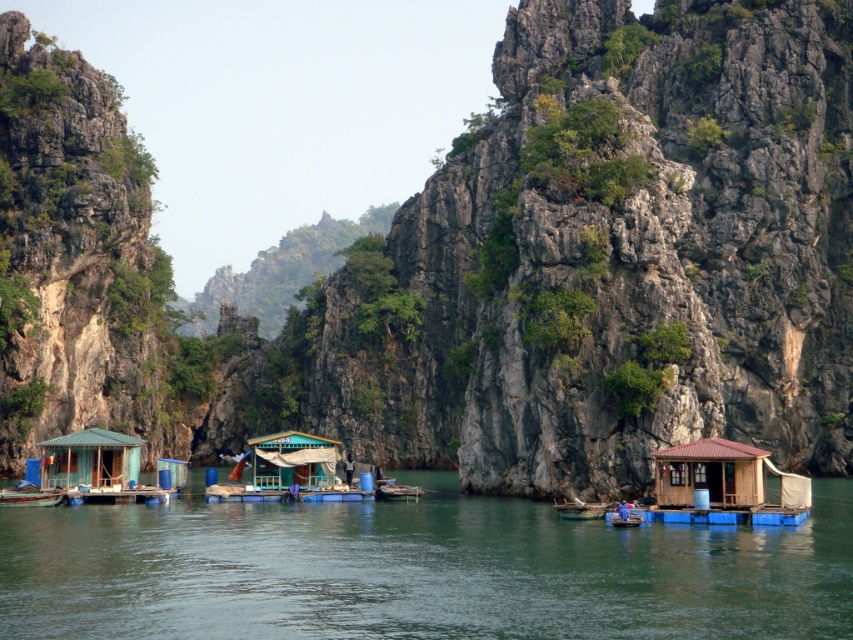
From the picture: Does greenish water at center appear over wooden boat at center?

No, greenish water at center is not above wooden boat at center.

Who is more forward, [595,628] or [606,502]?

Point [595,628] is in front.

Is point (173, 579) positioned before point (561, 515)?

Yes, point (173, 579) is in front of point (561, 515).

Where is `greenish water at center`? This screenshot has width=853, height=640. greenish water at center is located at coordinates (416, 570).

Is point (682, 502) positioned before point (268, 448)?

That is True.

At what (x,y) coordinates should I click in order to perform the action: click on brown wooden hut at lower right. Please return your answer as a coordinate pair (x, y). Looking at the image, I should click on (711, 474).

The image size is (853, 640). Identify the location of brown wooden hut at lower right. (711, 474).

Is wooden hut at center wider than wooden boat at center?

Indeed, wooden hut at center has a greater width compared to wooden boat at center.

This screenshot has height=640, width=853. What do you see at coordinates (293, 460) in the screenshot?
I see `wooden hut at center` at bounding box center [293, 460].

Find the location of a particular element. wooden hut at center is located at coordinates (293, 460).